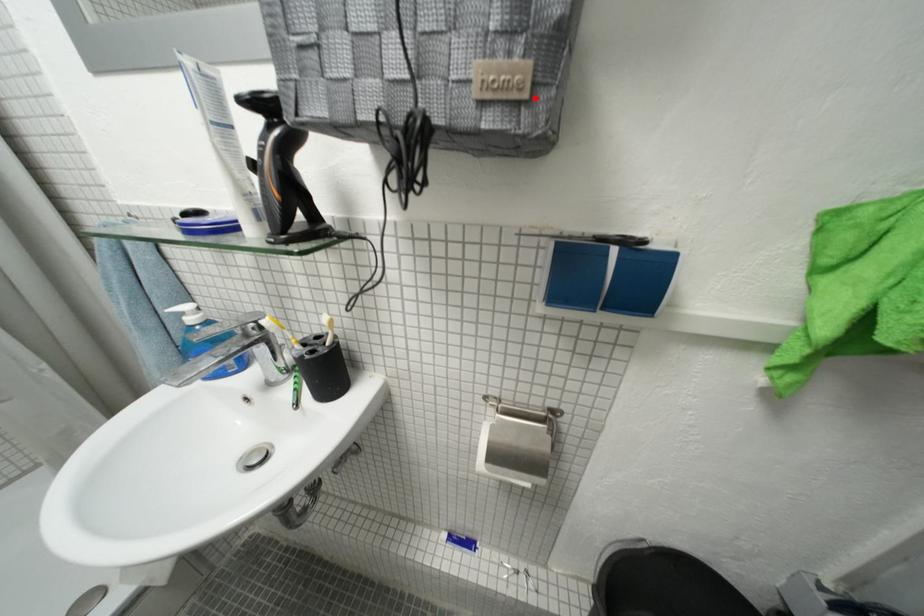
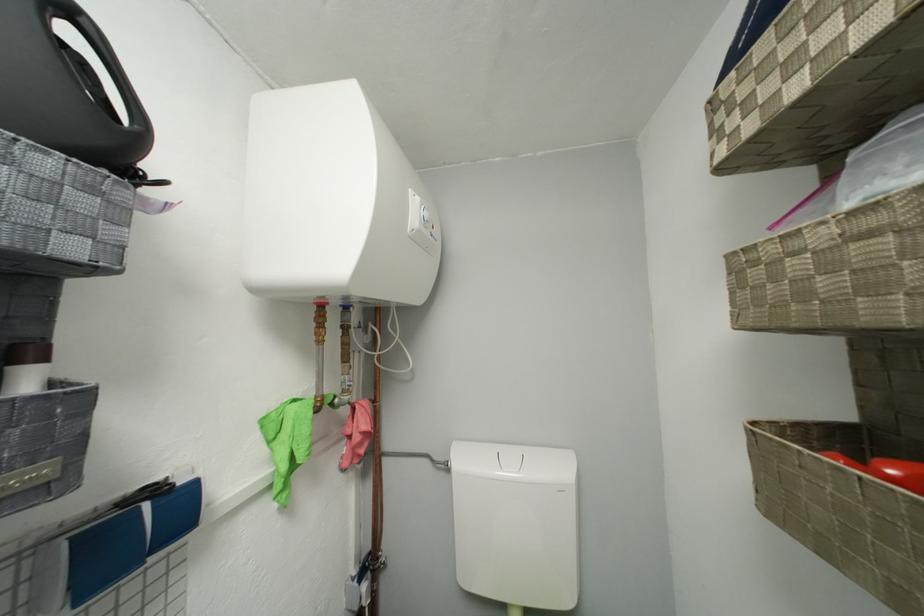
Find the pixel in the second image that matches the highlighted location in the first image.

(66, 477)